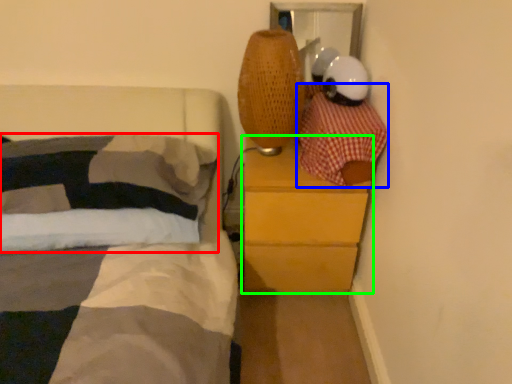
Question: Which object is positioned farthest from pillow (highlighted by a red box)? Select from blanket (highlighted by a blue box) and chest of drawers (highlighted by a green box).

Choices:
 (A) blanket
 (B) chest of drawers

Answer: (A)